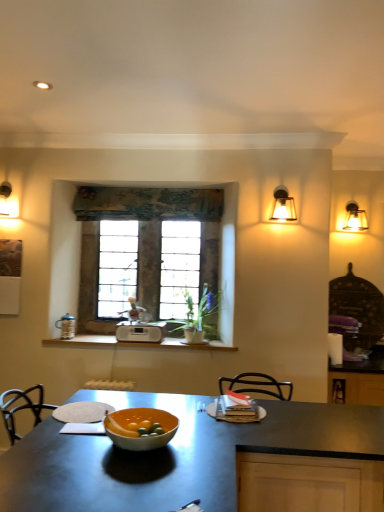
Question: Is point (145, 335) positioned closer to the camera than point (163, 274)?

Choices:
 (A) closer
 (B) farther

Answer: (A)

Question: Looking at their shapes, would you say white plastic radio at center is wider or thinner than stone textured window at center?

Choices:
 (A) wide
 (B) thin

Answer: (A)

Question: Estimate the real-world distances between objects in this image. Which object is closer to the textured fabric curtain at center?

Choices:
 (A) white plastic radio at center
 (B) glossy black countertop at center
 (C) white wood counter at center
 (D) matte orange bowl at center
 (E) matte glass sconce at upper right

Answer: (E)

Question: Which object is positioned farthest from the white plastic radio at center?

Choices:
 (A) matte glass sconce at upper right
 (B) white wood counter at center
 (C) matte glass sconce at upper right
 (D) glossy black countertop at center
 (E) textured fabric curtain at center

Answer: (C)